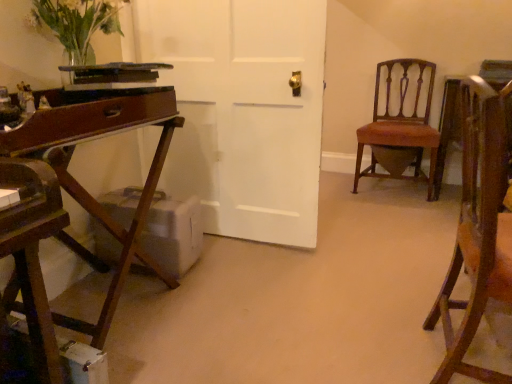
Question: Is translucent glass vase at upper left inside the boundaries of wooden chair at right, positioned as the 1th chair in front-to-back order, or outside?

Choices:
 (A) outside
 (B) inside

Answer: (A)

Question: Is point (99, 14) positioned closer to the camera than point (501, 216)?

Choices:
 (A) closer
 (B) farther

Answer: (B)

Question: Estimate the real-world distances between objects in this image. Which object is closer to the wooden desk at left?

Choices:
 (A) mahogany wood chair at right, which is the 1th chair from back to front
 (B) translucent glass vase at upper left
 (C) wooden chair at right, which is the second chair from back to front

Answer: (B)

Question: Which of these objects is positioned farthest from the translucent glass vase at upper left?

Choices:
 (A) wooden desk at left
 (B) mahogany wood chair at right, which is the 1th chair from back to front
 (C) wooden chair at right, positioned as the 1th chair in front-to-back order

Answer: (B)